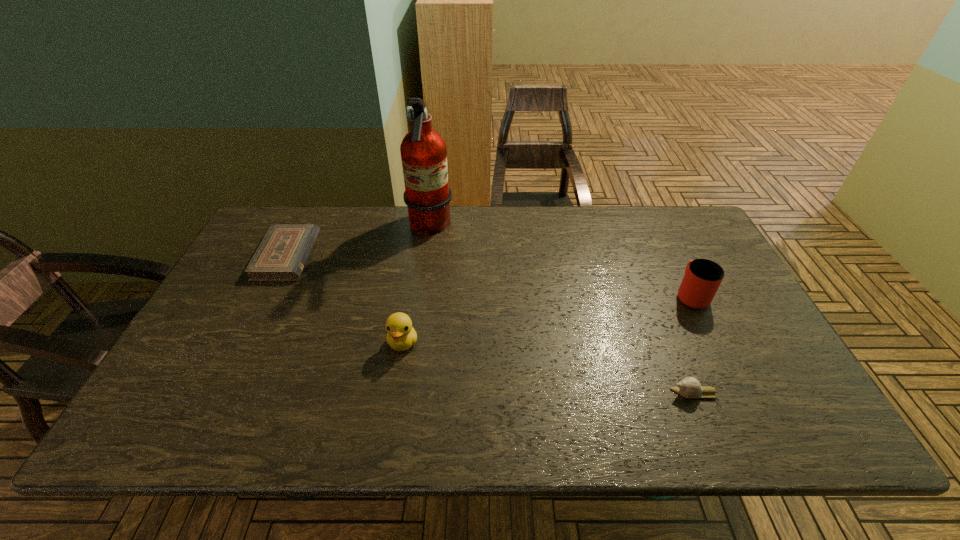
The image size is (960, 540). I want to click on vacant point that satisfies the following two spatial constraints: 1. on the nozzle and handle of the fire extinguisher; 2. on the handle side of the cup, so [420, 294].

Identify the location of blank space that satisfies the following two spatial constraints: 1. on the nozzle and handle of the fire extinguisher; 2. on the handle side of the rightmost object. This screenshot has width=960, height=540. (420, 294).

This screenshot has width=960, height=540. I want to click on vacant point that satisfies the following two spatial constraints: 1. on the spine side of the Bible; 2. on the handle side of the rightmost object, so click(268, 294).

Locate an element on the screen. This screenshot has height=540, width=960. vacant region that satisfies the following two spatial constraints: 1. on the handle side of the rightmost object; 2. on the nozzle and handle of the fire extinguisher is located at coordinates (659, 228).

The image size is (960, 540). I want to click on vacant region that satisfies the following two spatial constraints: 1. on the handle side of the rightmost object; 2. on the nozzle and handle of the tallest object, so click(659, 228).